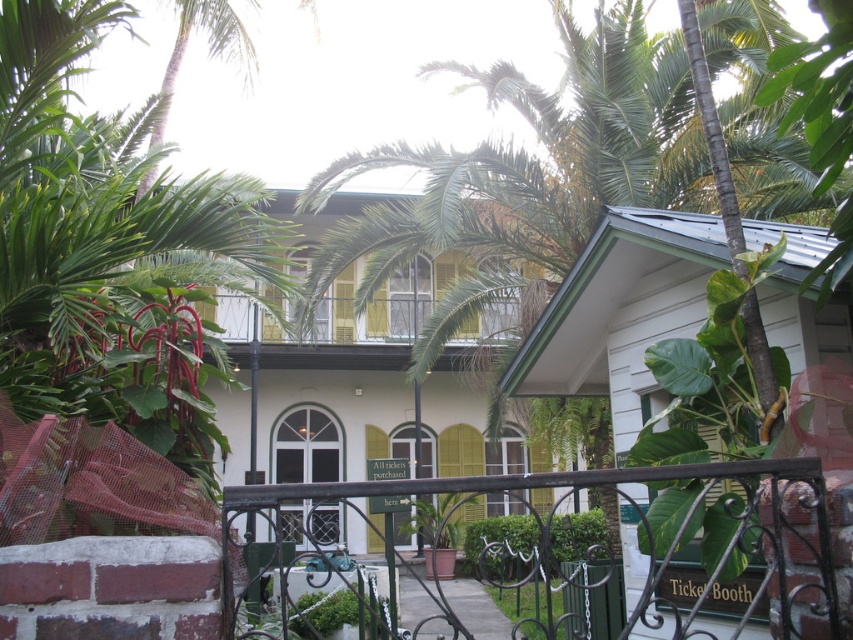
You are a visitor approaching the entrance of the building and see the green wrought iron fence at center and the wooden balcony at center. Which object is closer to the entrance?

The green wrought iron fence at center is closer to the entrance because it is to the right of the wooden balcony at center, meaning it is positioned nearer to the entrance path.

You are a visitor approaching the building and want to enter through the gate. Which object, the green wrought iron fence at center or the wooden balcony at center, do you need to pass under first?

You need to pass under the wooden balcony at center first because the green wrought iron fence at center is positioned under it.